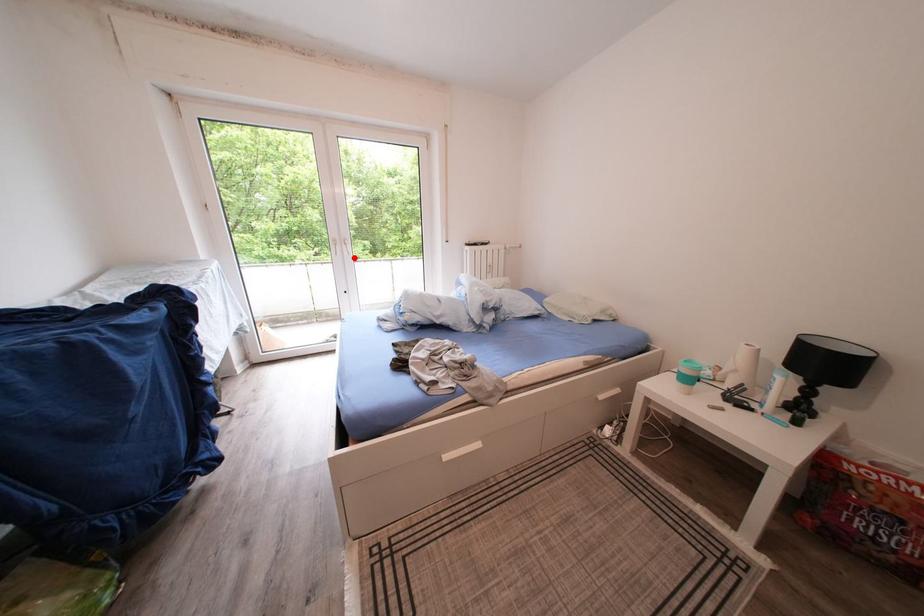
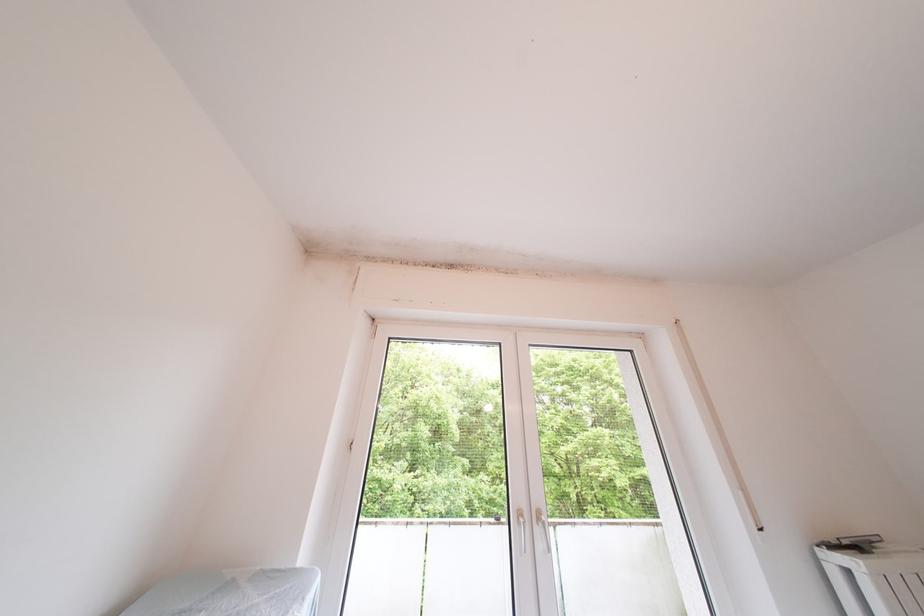
Question: I am providing you with two images of the same scene from different viewpoints. In image1, a red point is highlighted. Considering the same 3D point in image2, which of the following is correct?

Choices:
 (A) It is closer
 (B) It is farther

Answer: (B)